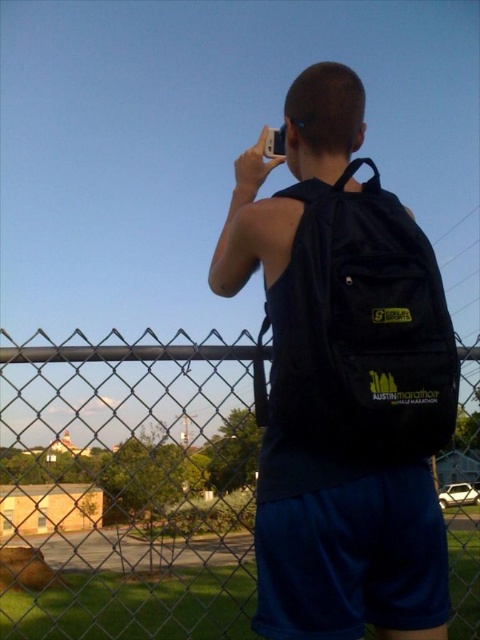
Question: Estimate the real-world distances between objects in this image. Which object is farther from the black fabric backpack at center?

Choices:
 (A) metal chain-link fence at center
 (B) black matte backpack at center

Answer: (A)

Question: Does black matte backpack at center lie behind metal chain-link fence at center?

Choices:
 (A) no
 (B) yes

Answer: (A)

Question: Estimate the real-world distances between objects in this image. Which object is closer to the black matte backpack at center?

Choices:
 (A) black fabric backpack at center
 (B) metal chain-link fence at center

Answer: (A)

Question: Can you confirm if metal chain-link fence at center is positioned to the left of black fabric backpack at center?

Choices:
 (A) no
 (B) yes

Answer: (A)

Question: Considering the real-world distances, which object is farthest from the black fabric backpack at center?

Choices:
 (A) metal chain-link fence at center
 (B) black matte backpack at center

Answer: (A)

Question: Is black matte backpack at center further to the viewer compared to metal chain-link fence at center?

Choices:
 (A) no
 (B) yes

Answer: (A)